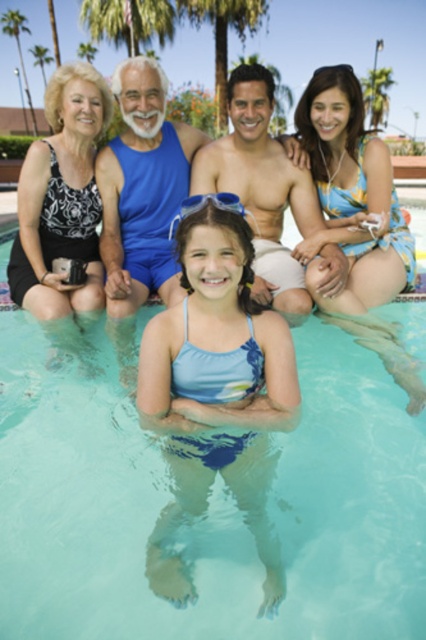
Between light blue fabric swimsuit at center and blue fabric shorts at upper center, which one appears on the right side from the viewer's perspective?

Positioned to the right is light blue fabric swimsuit at center.

Who is more distant from viewer, (181,385) or (123,307)?

Positioned behind is point (123,307).

Is point (158, 522) positioned after point (138, 237)?

That is False.

This screenshot has height=640, width=426. Find the location of `light blue fabric swimsuit at center`. light blue fabric swimsuit at center is located at coordinates (215, 392).

Is point (121, 3) positioned after point (253, 0)?

No.

Between green leafy palm tree at upper center and green leafy palm tree at center, which one is positioned lower?

green leafy palm tree at upper center is below.

You are a GUI agent. You are given a task and a screenshot of the screen. Output one action in this format:
    pyautogui.click(x=<x>, y=<y>)
    Task: Click on the green leafy palm tree at upper center
    This screenshot has height=640, width=426.
    Given the screenshot: What is the action you would take?
    pyautogui.click(x=129, y=20)

Does floral fabric bikini top at upper right have a greater width compared to matte blue swimsuit at center?

In fact, floral fabric bikini top at upper right might be narrower than matte blue swimsuit at center.

Can you confirm if floral fabric bikini top at upper right is bigger than matte blue swimsuit at center?

Actually, floral fabric bikini top at upper right might be smaller than matte blue swimsuit at center.

Where is `floral fabric bikini top at upper right`? floral fabric bikini top at upper right is located at coordinates (351, 196).